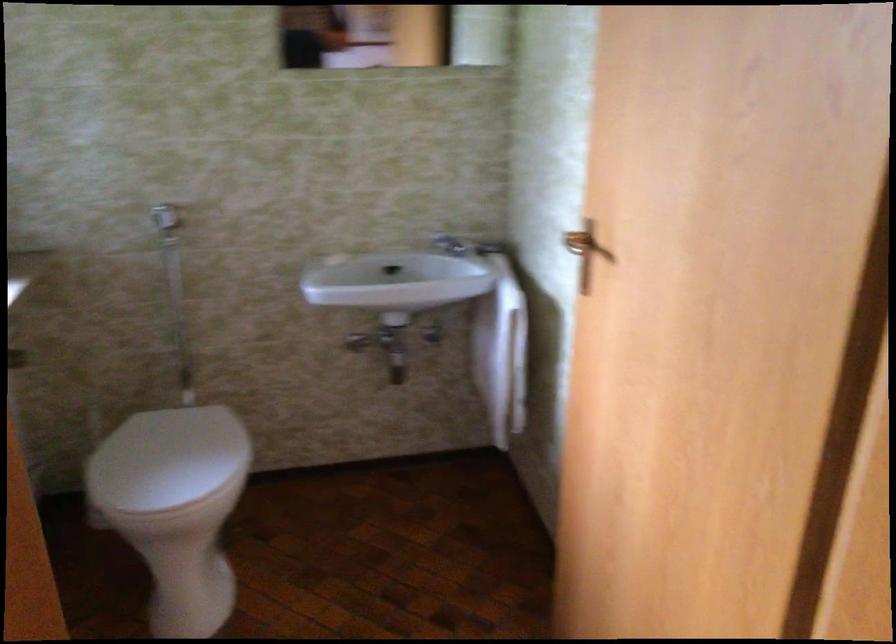
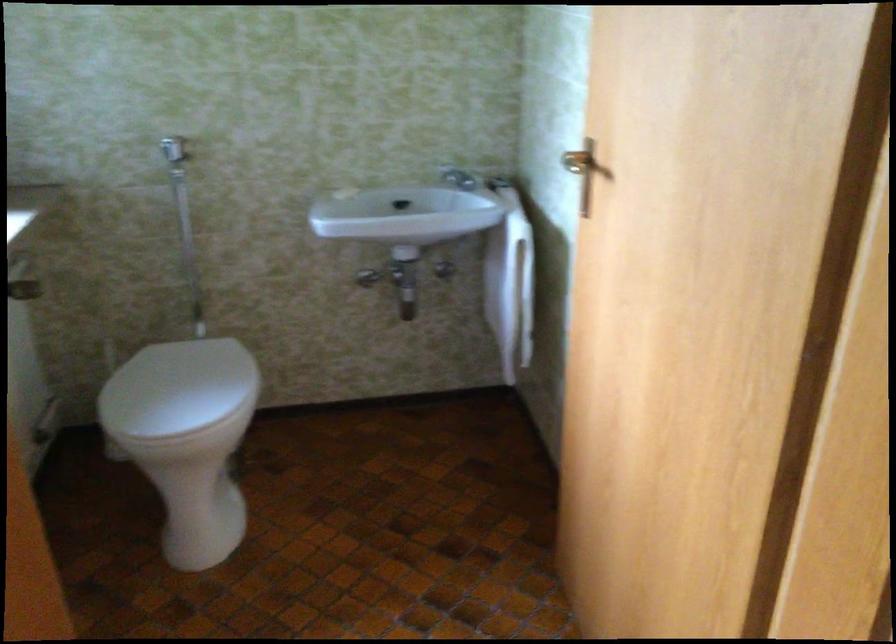
Question: Based on the continuous images, in which direction is the camera rotating? Reply with the corresponding letter.

Choices:
 (A) Left
 (B) Right
 (C) Up
 (D) Down

Answer: (D)